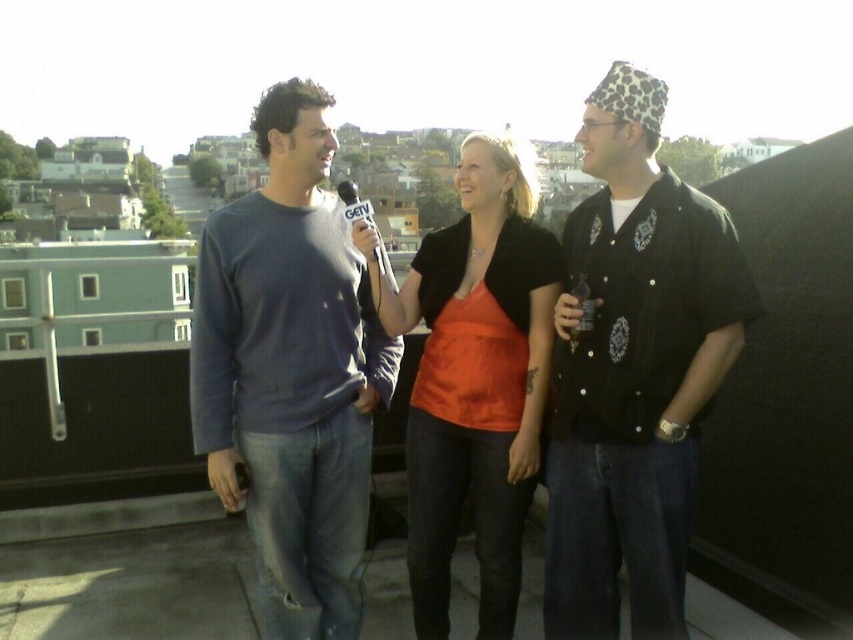
Is point (738, 260) farther from viewer compared to point (354, 220)?

No, it is in front of (354, 220).

Does leopard print fabric shirt at right have a lesser height compared to white plastic microphone at center?

Yes.

What do you see at coordinates (634, 371) in the screenshot?
I see `leopard print fabric shirt at right` at bounding box center [634, 371].

The image size is (853, 640). Find the location of `leopard print fabric shirt at right`. leopard print fabric shirt at right is located at coordinates (634, 371).

Does matte orange shirt at center lie in front of white plastic microphone at center?

Yes.

Which is above, matte orange shirt at center or white plastic microphone at center?

white plastic microphone at center is higher up.

What do you see at coordinates (474, 378) in the screenshot?
I see `matte orange shirt at center` at bounding box center [474, 378].

This screenshot has height=640, width=853. I want to click on matte orange shirt at center, so click(x=474, y=378).

Does dark blue cotton shirt at center appear on the left side of matte orange shirt at center?

Yes, dark blue cotton shirt at center is to the left of matte orange shirt at center.

This screenshot has width=853, height=640. In order to click on dark blue cotton shirt at center in this screenshot , I will do `click(291, 371)`.

Locate an element on the screen. The width and height of the screenshot is (853, 640). dark blue cotton shirt at center is located at coordinates (291, 371).